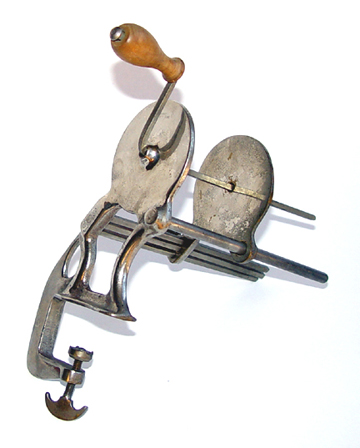
This screenshot has width=360, height=448. Identify the location of wooden element. click(151, 53).